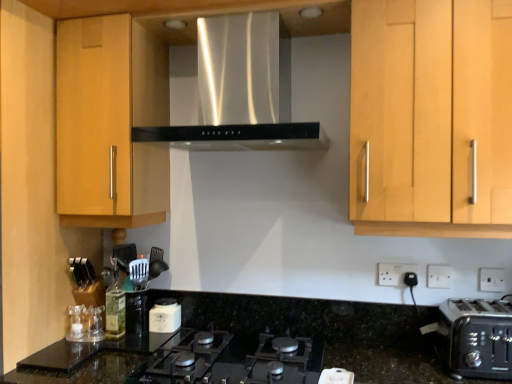
Question: Considering the relative sizes of white matte jar at center and white plastic toaster at lower right in the image provided, is white matte jar at center shorter than white plastic toaster at lower right?

Choices:
 (A) yes
 (B) no

Answer: (B)

Question: Is white matte jar at center outside of white plastic toaster at lower right?

Choices:
 (A) no
 (B) yes

Answer: (B)

Question: Is white matte jar at center taller than white plastic toaster at lower right?

Choices:
 (A) no
 (B) yes

Answer: (B)

Question: Is white matte jar at center facing towards white plastic toaster at lower right?

Choices:
 (A) no
 (B) yes

Answer: (A)

Question: Considering the relative sizes of white matte jar at center and white plastic toaster at lower right in the image provided, is white matte jar at center smaller than white plastic toaster at lower right?

Choices:
 (A) no
 (B) yes

Answer: (A)

Question: In the image, is white plastic electric outlet at lower right, which appears as the second electric outlet when viewed from the left, positioned in front of or behind white plastic toaster at lower right?

Choices:
 (A) front
 (B) behind

Answer: (B)

Question: Is white plastic electric outlet at lower right, which appears as the second electric outlet when viewed from the left, spatially inside white plastic toaster at lower right, or outside of it?

Choices:
 (A) outside
 (B) inside

Answer: (A)

Question: Considering the positions of white plastic electric outlet at lower right, arranged as the second electric outlet when viewed from the front, and white plastic toaster at lower right in the image, is white plastic electric outlet at lower right, arranged as the second electric outlet when viewed from the front, wider or thinner than white plastic toaster at lower right?

Choices:
 (A) wide
 (B) thin

Answer: (B)

Question: From their relative heights in the image, would you say white plastic electric outlet at lower right, arranged as the second electric outlet when viewed from the front, is taller or shorter than white plastic toaster at lower right?

Choices:
 (A) tall
 (B) short

Answer: (A)

Question: Considering their positions, is white plastic toaster at lower right located in front of or behind white plastic electric outlet at lower right, arranged as the first electric outlet when viewed from the back?

Choices:
 (A) behind
 (B) front

Answer: (B)

Question: Considering the positions of point (338, 380) and point (396, 279), is point (338, 380) closer or farther from the camera than point (396, 279)?

Choices:
 (A) closer
 (B) farther

Answer: (A)

Question: Based on their sizes in the image, would you say white plastic toaster at lower right is bigger or smaller than white plastic electric outlet at lower right, arranged as the first electric outlet when viewed from the back?

Choices:
 (A) small
 (B) big

Answer: (B)

Question: From a real-world perspective, is white plastic toaster at lower right above or below white plastic electric outlet at lower right, placed as the 3th electric outlet when sorted from right to left?

Choices:
 (A) above
 (B) below

Answer: (B)

Question: From the image's perspective, relative to white matte jar at center, is white plastic electric outlet at lower right, arranged as the first electric outlet when viewed from the back, above or below?

Choices:
 (A) above
 (B) below

Answer: (A)

Question: Considering the positions of point (404, 266) and point (169, 314), is point (404, 266) closer or farther from the camera than point (169, 314)?

Choices:
 (A) farther
 (B) closer

Answer: (B)